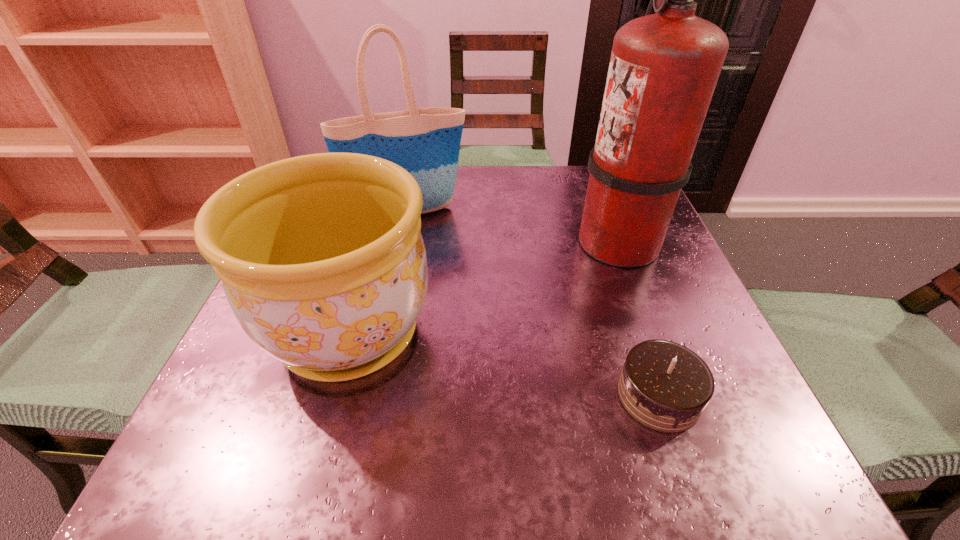
At what (x,y) coordinates should I click in order to perform the action: click on free area in between the tallest object and the chocolate cake. Please return your answer as a coordinate pair (x, y). This screenshot has height=540, width=960. Looking at the image, I should click on (638, 318).

Locate an element on the screen. The width and height of the screenshot is (960, 540). free space between the chocolate cake and the fire extinguisher is located at coordinates (638, 318).

This screenshot has width=960, height=540. I want to click on free space that is in between the third tallest object and the shortest object, so point(504,364).

The height and width of the screenshot is (540, 960). Identify the location of free space between the third tallest object and the chocolate cake. (504, 364).

I want to click on object that ranks as the second closest to the flowerpot, so click(664, 66).

Select which object is the second closest to the chocolate cake. Please provide its 2D coordinates. Your answer should be formatted as a tuple, i.e. [(x, y)], where the tuple contains the x and y coordinates of a point satisfying the conditions above.

[(322, 260)]

You are a GUI agent. You are given a task and a screenshot of the screen. Output one action in this format:
    pyautogui.click(x=<x>, y=<y>)
    Task: Click on the vacant region that satisfies the following two spatial constraints: 1. toward the nozzle of the fire extinguisher; 2. on the front side of the flowerpot
    The image size is (960, 540).
    Given the screenshot: What is the action you would take?
    pyautogui.click(x=653, y=333)

Locate an element on the screen. The width and height of the screenshot is (960, 540). vacant space that satisfies the following two spatial constraints: 1. toward the nozzle of the tallest object; 2. on the front side of the second shortest object is located at coordinates (653, 333).

This screenshot has width=960, height=540. Find the location of `vacant space that satisfies the following two spatial constraints: 1. toward the nozzle of the tallest object; 2. on the front side of the flowerpot`. vacant space that satisfies the following two spatial constraints: 1. toward the nozzle of the tallest object; 2. on the front side of the flowerpot is located at coordinates (653, 333).

The height and width of the screenshot is (540, 960). What are the coordinates of `vacant space that satisfies the following two spatial constraints: 1. on the front side of the tote bag; 2. on the right side of the shortest object` in the screenshot? It's located at (368, 396).